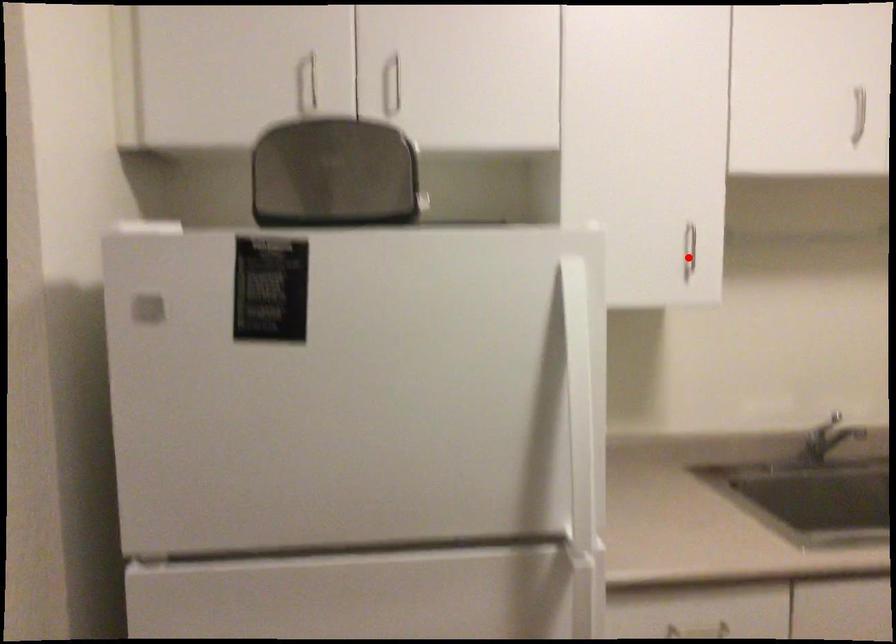
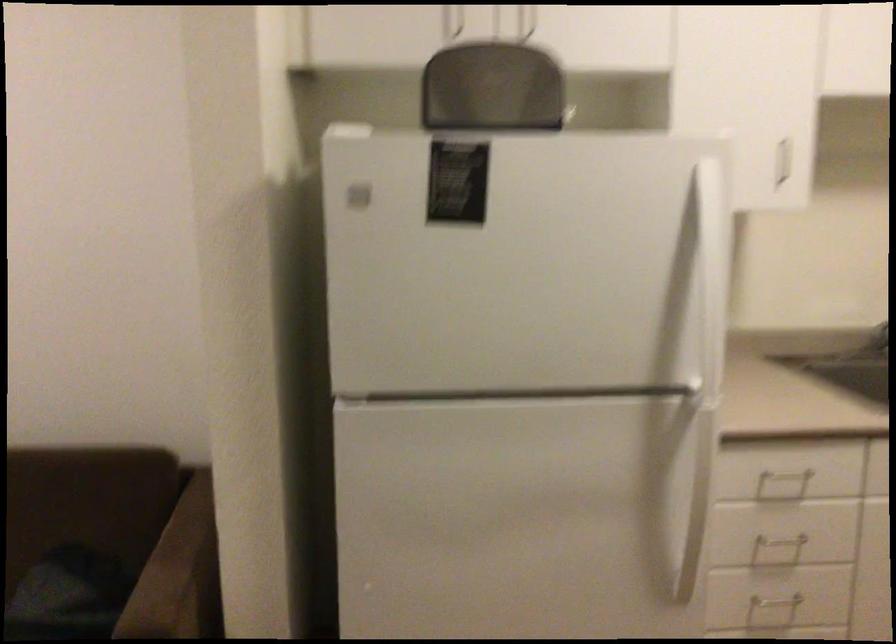
Locate, in the second image, the point that corresponds to the highlighted location in the first image.

(785, 160)